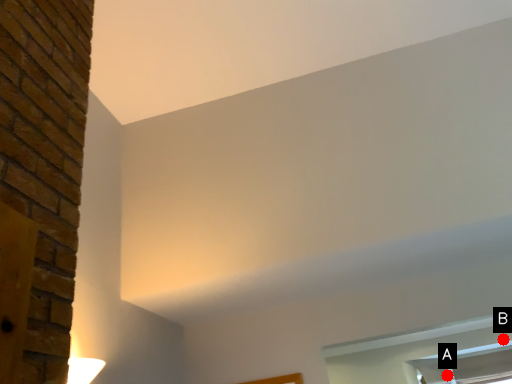
Question: Two points are circled on the image, labeled by A and B beside each circle. Which point appears farthest from the camera in this image?

Choices:
 (A) A is further
 (B) B is further

Answer: (A)